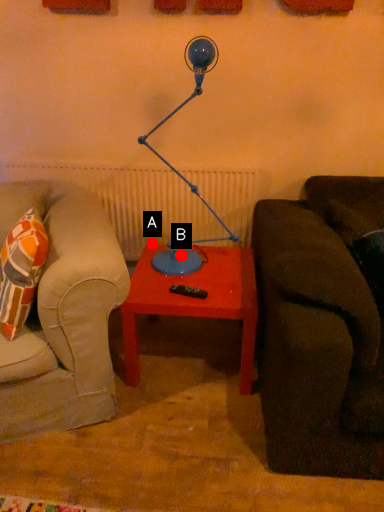
Question: Two points are circled on the image, labeled by A and B beside each circle. Which point is further to the camera?

Choices:
 (A) A is further
 (B) B is further

Answer: (A)